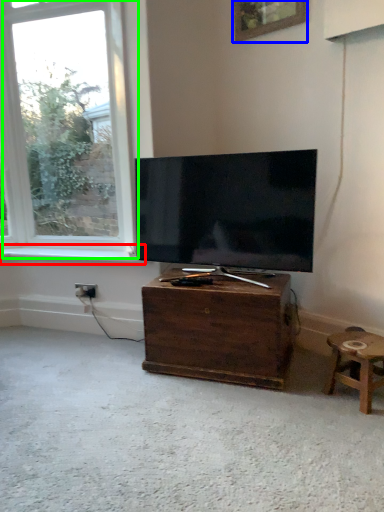
Question: Estimate the real-world distances between objects in this image. Which object is farther from window sill (highlighted by a red box), picture frame (highlighted by a blue box) or window (highlighted by a green box)?

Choices:
 (A) picture frame
 (B) window

Answer: (A)